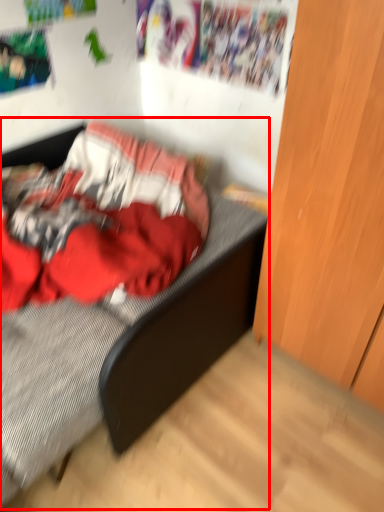
Question: From the image's perspective, where is bed (annotated by the red box) located in relation to dresser in the image?

Choices:
 (A) below
 (B) above

Answer: (A)